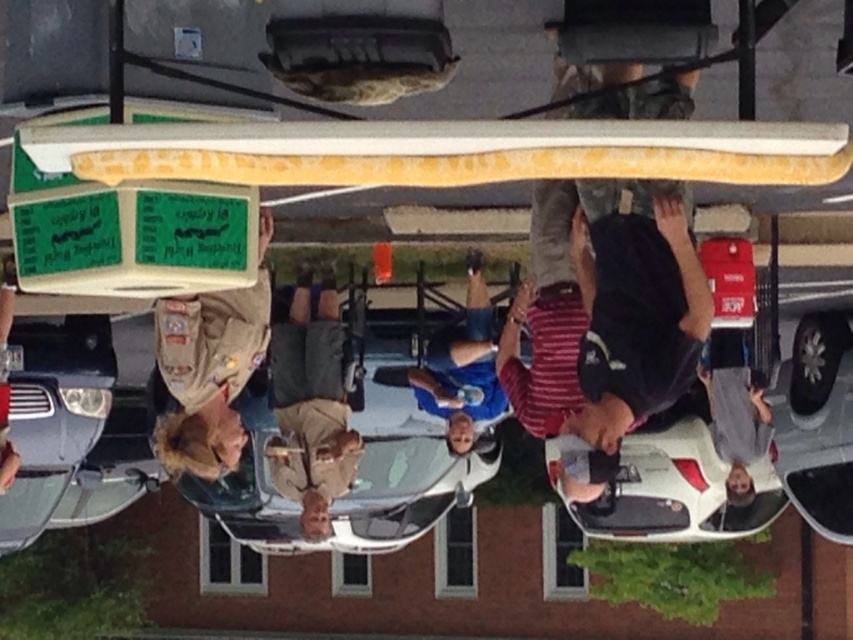
Between brown uniform at center and blue denim jeans at center, which one appears on the left side from the viewer's perspective?

brown uniform at center is more to the left.

Is point (178, 467) less distant than point (500, 392)?

Yes, point (178, 467) is closer to viewer.

Between point (212, 397) and point (486, 376), which one is positioned behind?

The point (486, 376) is more distant.

The height and width of the screenshot is (640, 853). Identify the location of brown uniform at center. (210, 368).

Is metallic silver car at center above white glossy car at lower center?

No, metallic silver car at center is not above white glossy car at lower center.

Between metallic silver car at center and white glossy car at lower center, which one has more height?

white glossy car at lower center

Is point (421, 467) more distant than point (676, 448)?

Yes, it is.

I want to click on metallic silver car at center, so click(x=352, y=481).

Describe the element at coordinates (665, 488) in the screenshot. I see `white glossy car at lower center` at that location.

Based on the photo, who is shorter, white glossy car at lower center or brown uniform at center?

Standing shorter between the two is brown uniform at center.

Does point (634, 515) come closer to viewer compared to point (257, 326)?

No, it is behind (257, 326).

The height and width of the screenshot is (640, 853). What are the coordinates of `white glossy car at lower center` in the screenshot? It's located at (665, 488).